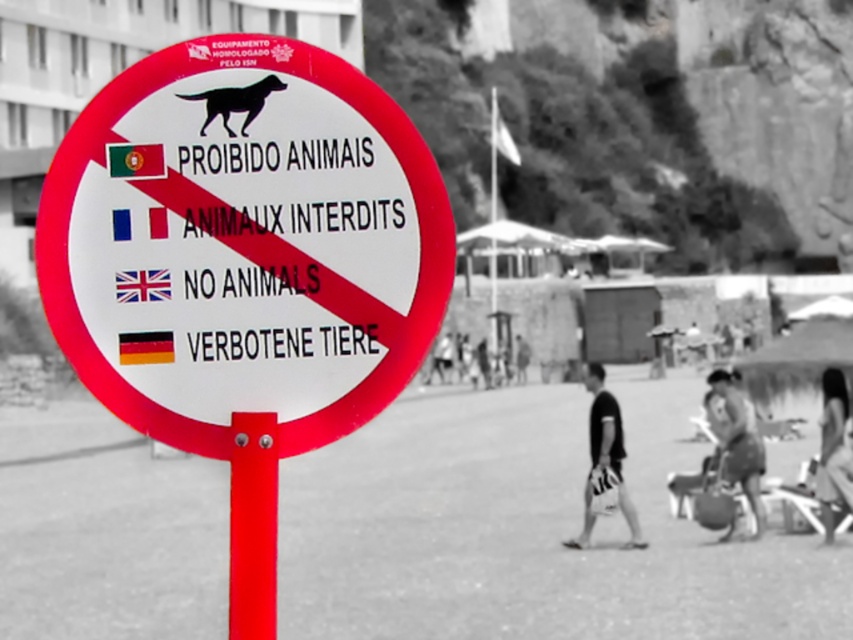
Question: Does matte black bag at lower right have a larger size compared to smooth fabric shirt at lower right?

Choices:
 (A) no
 (B) yes

Answer: (A)

Question: Estimate the real-world distances between objects in this image. Which object is closer to the white plastic sign at center?

Choices:
 (A) smooth fabric shirt at lower right
 (B) dark skin textured shorts at lower right

Answer: (B)

Question: Is smooth sand beach at center to the left of matte black bag at lower right from the viewer's perspective?

Choices:
 (A) yes
 (B) no

Answer: (A)

Question: Can you confirm if smooth sand beach at center is wider than white plastic sign at center?

Choices:
 (A) no
 (B) yes

Answer: (B)

Question: Among these objects, which one is nearest to the camera?

Choices:
 (A) white plastic sign at center
 (B) matte black bag at lower right
 (C) dark skin textured shorts at lower right

Answer: (A)

Question: Which is nearer to the white plastic sign at center?

Choices:
 (A) smooth sand beach at center
 (B) matte black bag at lower right
 (C) red plastic pole at center
 (D) smooth fabric shirt at lower right

Answer: (C)